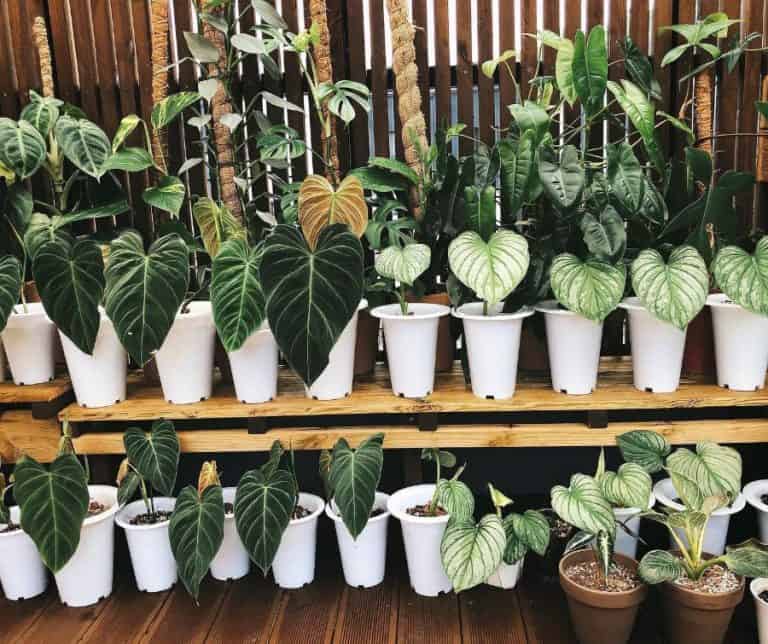
Locate an element on the screen. Image resolution: width=768 pixels, height=644 pixels. pot is located at coordinates (94, 373).